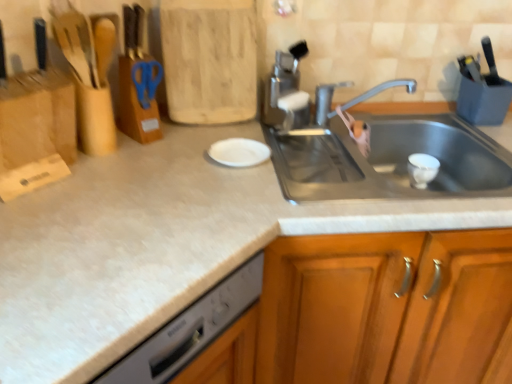
Where is `vacant area located to the right-hand side of satin nickel faucet at upper center`? This screenshot has width=512, height=384. vacant area located to the right-hand side of satin nickel faucet at upper center is located at coordinates (335, 135).